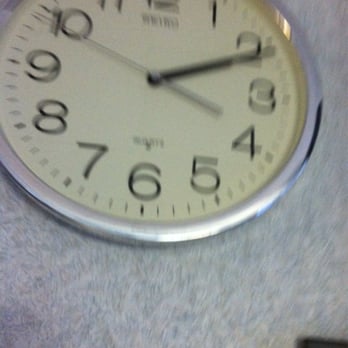
I want to click on blurry clock second hand, so click(x=46, y=18), click(x=98, y=44), click(x=143, y=70).